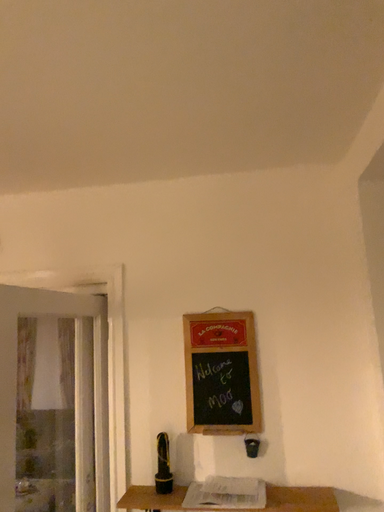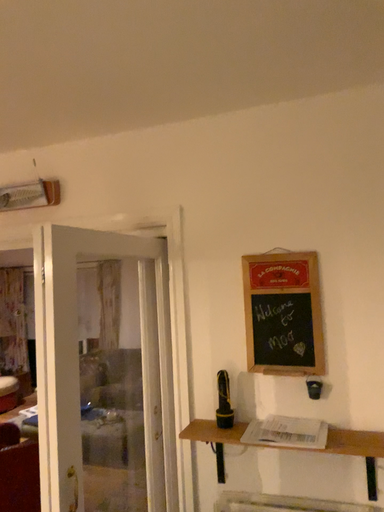
Question: How did the camera likely rotate when shooting the video?

Choices:
 (A) rotated upward
 (B) rotated downward

Answer: (B)